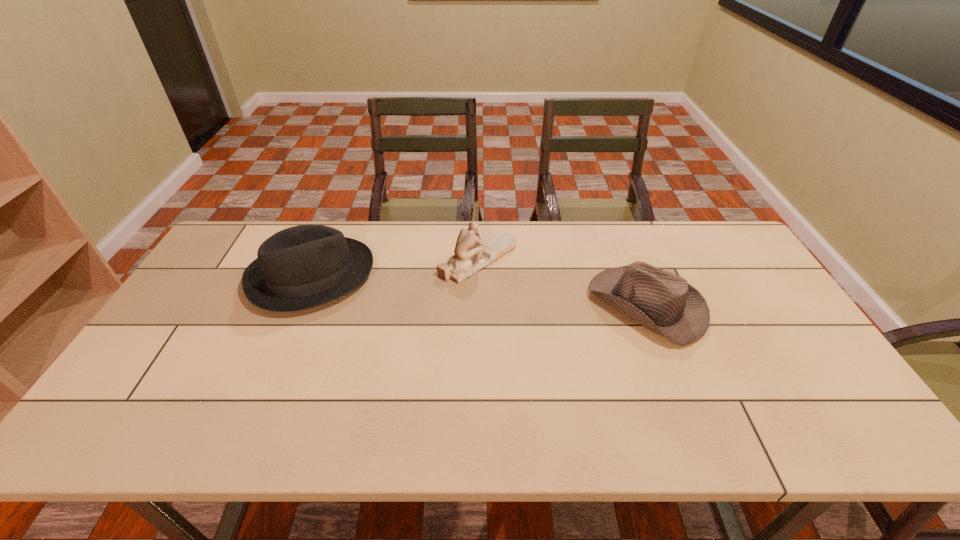
Choose which object is the second nearest neighbor to the taller fedora. Please provide its 2D coordinates. Your answer should be formatted as a tuple, i.e. [(x, y)], where the tuple contains the x and y coordinates of a point satisfying the conditions above.

[(664, 303)]

Locate an element on the screen. The image size is (960, 540). vacant area that satisfies the following two spatial constraints: 1. on the front-facing side of the rightmost object; 2. on the right side of the second object from left to right is located at coordinates (478, 305).

You are a GUI agent. You are given a task and a screenshot of the screen. Output one action in this format:
    pyautogui.click(x=<x>, y=<y>)
    Task: Click on the free location that satisfies the following two spatial constraints: 1. on the front-facing side of the second object from right to left; 2. on the back side of the shortest object
    This screenshot has height=540, width=960.
    Given the screenshot: What is the action you would take?
    pyautogui.click(x=478, y=305)

Locate an element on the screen. Image resolution: width=960 pixels, height=540 pixels. blank space that satisfies the following two spatial constraints: 1. on the front-facing side of the rightmost object; 2. on the left side of the figurine is located at coordinates pyautogui.click(x=478, y=305).

In order to click on vacant area that satisfies the following two spatial constraints: 1. on the front-facing side of the figurine; 2. on the left side of the shortest object in this screenshot , I will do `click(478, 305)`.